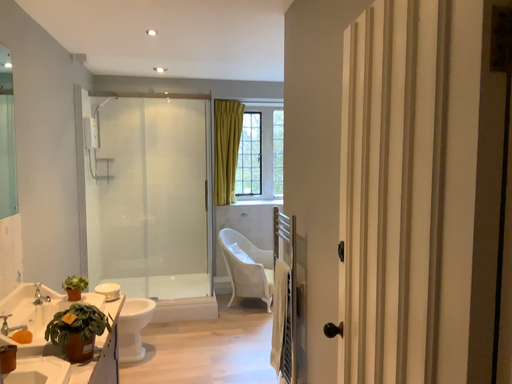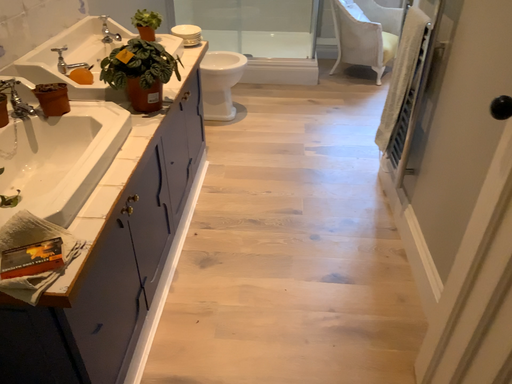
Question: Which way did the camera rotate in the video?

Choices:
 (A) rotated upward
 (B) rotated downward

Answer: (B)